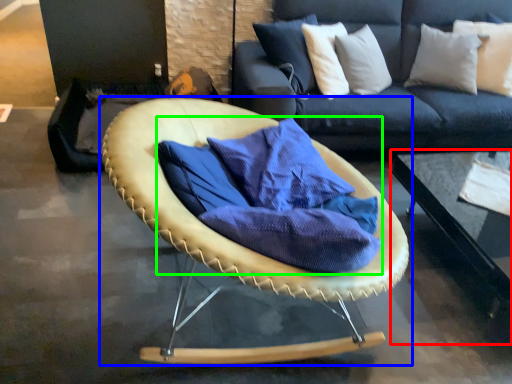
Question: Which object is positioned closest to table (highlighted by a red box)? Select from chair (highlighted by a blue box) and fabric (highlighted by a green box).

Choices:
 (A) chair
 (B) fabric

Answer: (B)